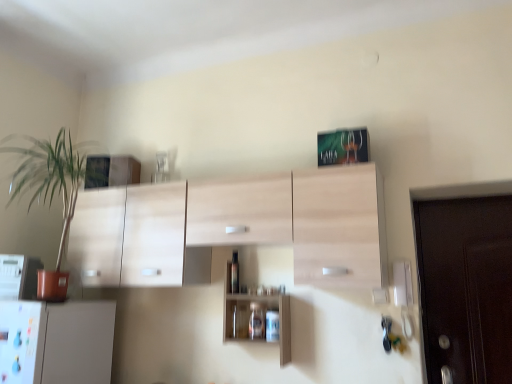
Measure the distance between point (x=233, y=278) and camera.

7.78 feet.

Identify the location of wooden cabinet at center. (262, 318).

Where is `transparent glass bottle at center`? transparent glass bottle at center is located at coordinates (234, 273).

Does green leafy plant at left have a larger size compared to wooden cabinet at center?

Yes.

Which point is more distant from viewer, [65,168] or [241,307]?

Positioned behind is point [65,168].

From the image's perspective, would you say green leafy plant at left is shown under wooden cabinet at center?

No.

Considering the positions of point (234, 292) and point (47, 182), is point (234, 292) closer or farther from the camera than point (47, 182)?

Point (234, 292) is closer to the camera than point (47, 182).

Is transparent glass bottle at center oriented towards green leafy plant at left?

No, transparent glass bottle at center is not facing towards green leafy plant at left.

From the picture: Are transparent glass bottle at center and green leafy plant at left located far from each other?

Yes, transparent glass bottle at center and green leafy plant at left are located far from each other.

How much distance is there between transparent glass bottle at center and green leafy plant at left?

transparent glass bottle at center is 1.24 meters away from green leafy plant at left.

Based on the photo, is white plastic microwave at left to the left of wooden cabinet at center from the viewer's perspective?

Correct, you'll find white plastic microwave at left to the left of wooden cabinet at center.

Based on the photo, is white plastic microwave at left spatially inside wooden cabinet at center, or outside of it?

white plastic microwave at left is spatially situated outside wooden cabinet at center.

Is white plastic microwave at left not near wooden cabinet at center?

Absolutely, white plastic microwave at left is distant from wooden cabinet at center.

Does white plastic microwave at left turn towards wooden cabinet at center?

No, white plastic microwave at left is not facing towards wooden cabinet at center.

How different are the orientations of green leafy plant at left and white plastic microwave at left in degrees?

There is a 24.2-degree angle between the facing directions of green leafy plant at left and white plastic microwave at left.

Considering their positions, is green leafy plant at left located in front of or behind white plastic microwave at left?

Visually, green leafy plant at left is located in front of white plastic microwave at left.

Considering the sizes of objects green leafy plant at left and white plastic microwave at left in the image provided, who is taller, green leafy plant at left or white plastic microwave at left?

Standing taller between the two is green leafy plant at left.

From a real-world perspective, who is located lower, green leafy plant at left or white plastic microwave at left?

white plastic microwave at left, from a real-world perspective.

Consider the image. From a real-world perspective, is wooden cabinet at center on green leafy plant at left?

Incorrect, from a real-world perspective, wooden cabinet at center is lower than green leafy plant at left.

Is wooden cabinet at center wider than green leafy plant at left?

No, wooden cabinet at center is not wider than green leafy plant at left.

From the image's perspective, is wooden cabinet at center located above green leafy plant at left?

No, from the image's perspective, wooden cabinet at center is not on top of green leafy plant at left.

What are the coordinates of `houseplant on the left of the wooden cabinet at center` in the screenshot? It's located at (51, 193).

Is transparent glass bottle at center placed right next to white plastic microwave at left?

No, transparent glass bottle at center is not touching white plastic microwave at left.

Is the depth of transparent glass bottle at center greater than that of white plastic microwave at left?

Yes, transparent glass bottle at center is behind white plastic microwave at left.

Is point (234, 252) positioned before point (12, 267)?

No, (234, 252) is behind (12, 267).

From the image's perspective, who appears lower, transparent glass bottle at center or white plastic microwave at left?

white plastic microwave at left.

In order to click on bottle on the left of wooden cabinet at center in this screenshot , I will do `click(234, 273)`.

Is wooden cabinet at center positioned far away from transparent glass bottle at center?

No, wooden cabinet at center is not far from transparent glass bottle at center.

Is wooden cabinet at center smaller than transparent glass bottle at center?

Actually, wooden cabinet at center might be larger than transparent glass bottle at center.

Locate an element on the screen. houseplant above the wooden cabinet at center (from a real-world perspective) is located at coordinates (51, 193).

Locate an element on the screen. The image size is (512, 384). houseplant in front of the transparent glass bottle at center is located at coordinates (51, 193).

Which object lies further to the anchor point wooden cabinet at center, white plastic microwave at left or transparent glass bottle at center?

white plastic microwave at left.

From the picture: Looking at the image, which one is located closer to transparent glass bottle at center, wooden cabinet at center or white plastic microwave at left?

wooden cabinet at center is positioned closer to the anchor transparent glass bottle at center.

Considering their positions, is white plastic microwave at left positioned closer to wooden cabinet at center than green leafy plant at left?

Among the two, white plastic microwave at left is located nearer to wooden cabinet at center.

Considering their positions, is transparent glass bottle at center positioned closer to white plastic microwave at left than green leafy plant at left?

green leafy plant at left is positioned closer to the anchor white plastic microwave at left.

In the scene shown: Looking at the image, which one is located further to white plastic microwave at left, green leafy plant at left or wooden cabinet at center?

wooden cabinet at center.

Based on their spatial positions, is wooden cabinet at center or transparent glass bottle at center closer to white plastic microwave at left?

transparent glass bottle at center is positioned closer to the anchor white plastic microwave at left.

Looking at the image, which one is located further to green leafy plant at left, wooden cabinet at center or transparent glass bottle at center?

Based on the image, wooden cabinet at center appears to be further to green leafy plant at left.

Based on their spatial positions, is green leafy plant at left or white plastic microwave at left closer to wooden cabinet at center?

Based on the image, white plastic microwave at left appears to be nearer to wooden cabinet at center.

You are a GUI agent. You are given a task and a screenshot of the screen. Output one action in this format:
    pyautogui.click(x=<x>, y=<y>)
    Task: Click on the bottle between green leafy plant at left and wooden cabinet at center
    
    Given the screenshot: What is the action you would take?
    pyautogui.click(x=234, y=273)

Locate an element on the screen. The image size is (512, 384). bottle between white plastic microwave at left and wooden cabinet at center is located at coordinates (234, 273).

Where is `houseplant located between white plastic microwave at left and wooden cabinet at center in the left-right direction`? This screenshot has width=512, height=384. houseplant located between white plastic microwave at left and wooden cabinet at center in the left-right direction is located at coordinates (51, 193).

Where is `houseplant located between white plastic microwave at left and transparent glass bottle at center in the left-right direction`? The height and width of the screenshot is (384, 512). houseplant located between white plastic microwave at left and transparent glass bottle at center in the left-right direction is located at coordinates (51, 193).